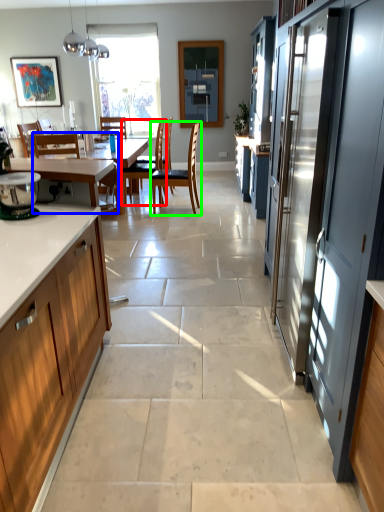
Question: Which object is positioned closest to chair (highlighted by a red box)? Select from chair (highlighted by a blue box) and chair (highlighted by a green box).

Choices:
 (A) chair
 (B) chair

Answer: (B)